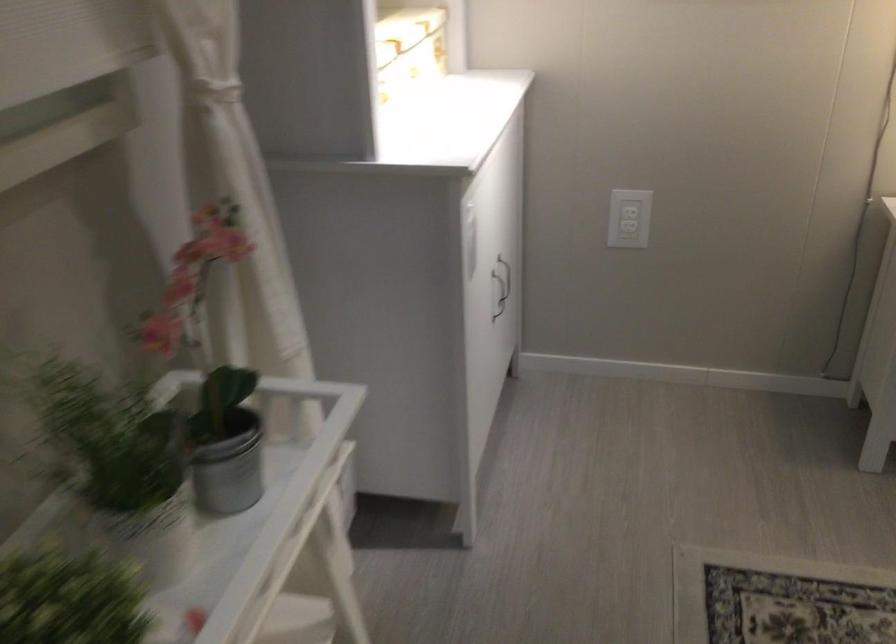
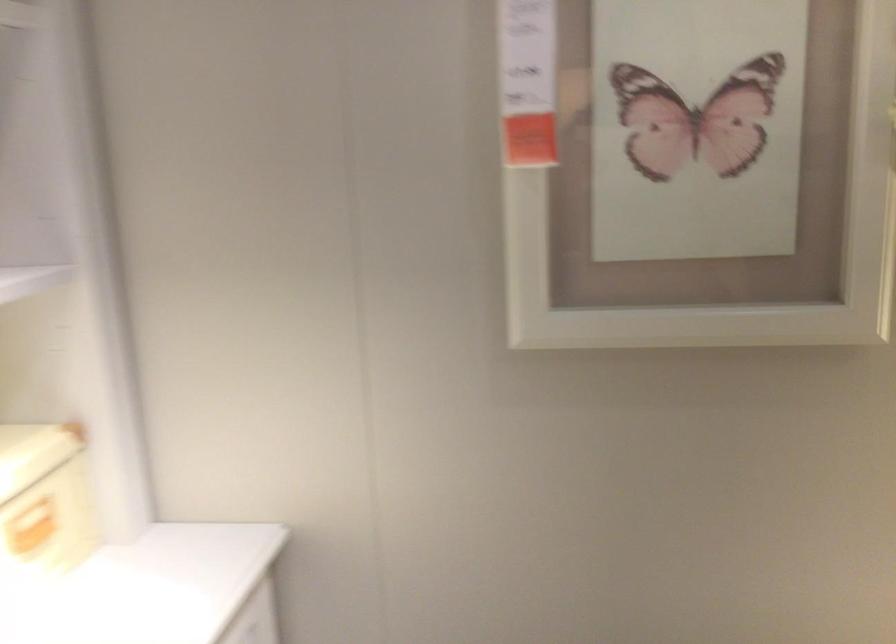
Question: Which direction would the cameraman need to move to produce the second image? Reply with the corresponding letter.

Choices:
 (A) Left
 (B) Right
 (C) Forward
 (D) Backward

Answer: (C)